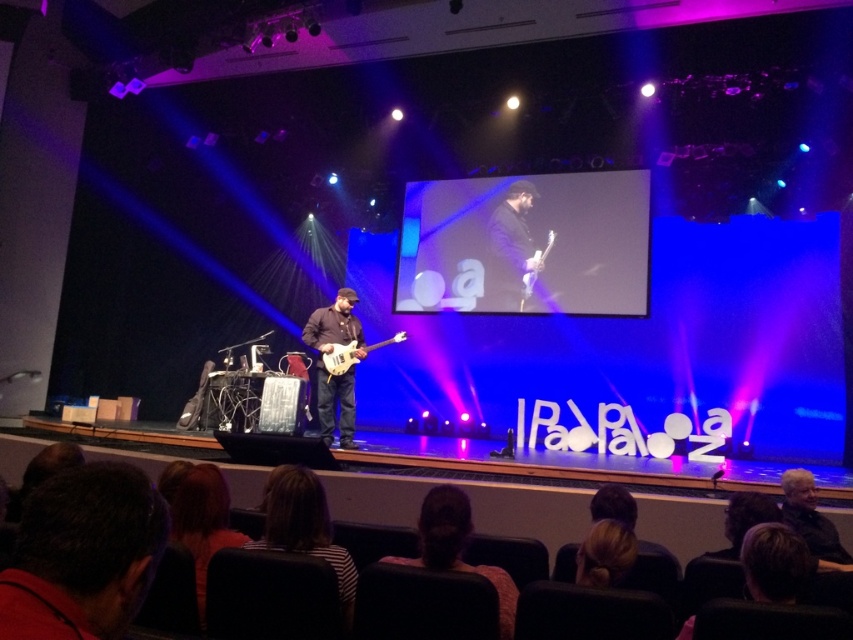
You are a stagehand who needs to move a 10 feet long ladder from the shiny black guitar at center to the glossy white electric guitar at upper center. Can you move the ladder without tilting it horizontally?

The distance between the shiny black guitar at center and the glossy white electric guitar at upper center is 11.02 feet. Since the ladder is 10 feet long, it is shorter than the distance between them. Therefore, the ladder can be moved horizontally between them without tilting.

You are a stagehand responsible for setting up the guitars for the next performance. You have to place both the shiny black guitar at center and the glossy white electric guitar at upper center on a stand. Given that the stand can only hold one guitar at a time, which guitar should you place first based on their sizes?

The shiny black guitar at center is larger in size than the glossy white electric guitar at upper center, so you should place the shiny black guitar at center first to ensure it fits properly on the stand.

In the scene shown: You are a photographer positioned at the front of the stage. You want to take a photo that includes both the point at (521, 202) and the point at (526, 278). Which point will appear closer to the camera in your photo?

Point at (521, 202) will appear closer to the camera because it is further to the camera than point at (526, 278).